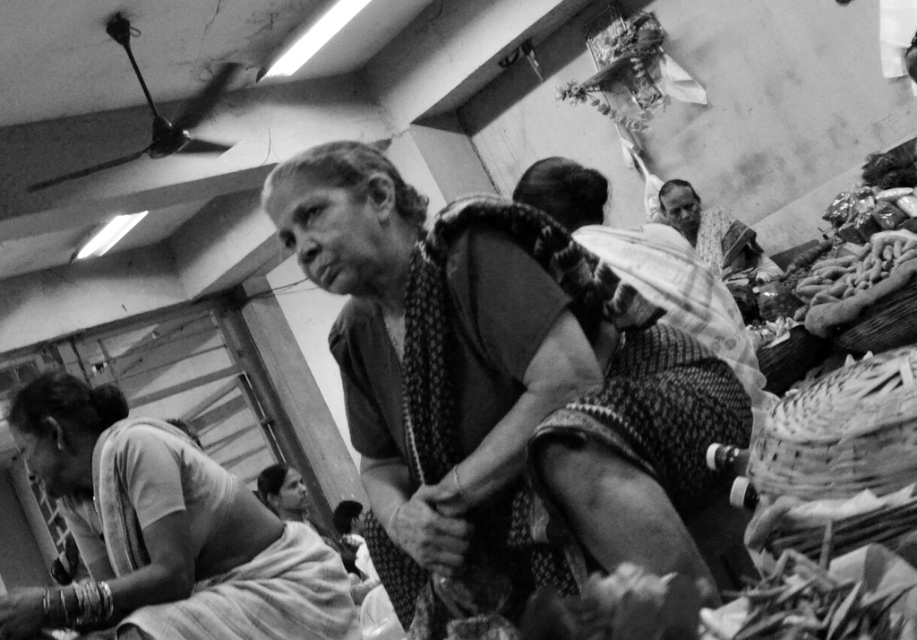
You are standing in the market and want to find the silky white saree at left. According to the coordinates given, where should you look relative to the center of the image?

The silky white saree at left is located at coordinates 0.833 on the x axis and 0.179 on the y axis, which means it is positioned to the far right and slightly below the center of the image.

Based on the scene described, which object is shorter between the silky white saree at left and the patterned fabric man at upper right?

The silky white saree at left is shorter than the patterned fabric man at upper right.